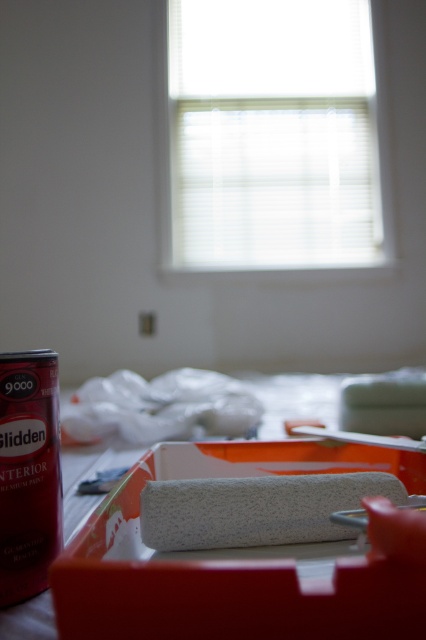
You are standing in the room and see the point at coordinates (x=256, y=508). What object is located at that point?

The point at coordinates (x=256, y=508) corresponds to the white textured roller at center.

You are a painter who needs to move a ladder from the white textured roller at center to the white textured paint roller at lower center. The ladder is 4 feet long. Will the ladder fit between them without being moved?

The distance between the white textured roller at center and the white textured paint roller at lower center is 3.71 feet, which is less than the ladder length of 4 feet. Therefore, the ladder will fit between them without needing to be moved.